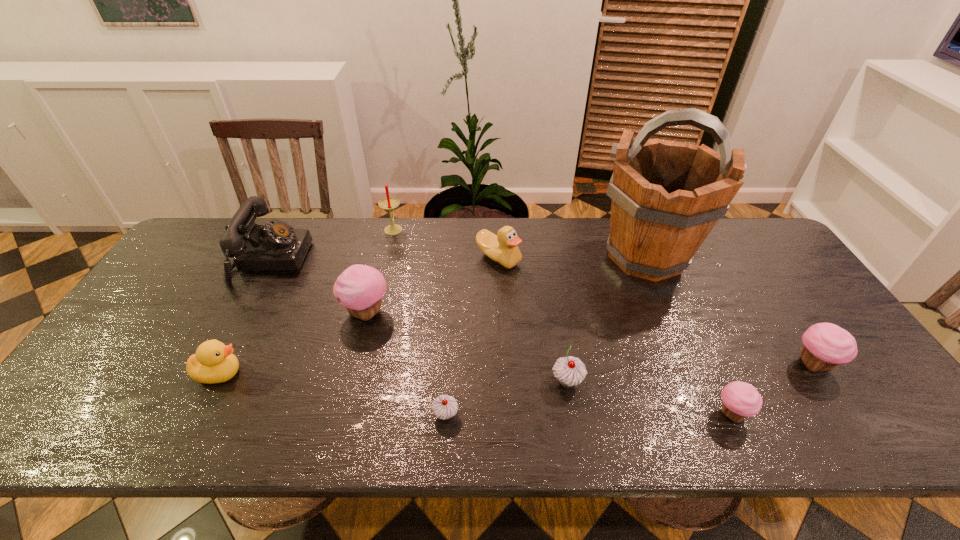
Locate an element on the screen. Image resolution: width=960 pixels, height=540 pixels. bucket is located at coordinates click(667, 196).

Find the location of a particular element. This screenshot has width=960, height=540. candle is located at coordinates (389, 203).

Locate an element on the screen. Image resolution: width=960 pixels, height=540 pixels. black telephone is located at coordinates (276, 246).

This screenshot has width=960, height=540. What are the coordinates of `the tallest cupcake` in the screenshot? It's located at (360, 288).

Identify the location of the sixth nearest object. [360, 288].

Where is `duck`? duck is located at coordinates (503, 248).

Locate an element on the screen. This screenshot has height=540, width=960. beige duck is located at coordinates (503, 248).

Locate an element on the screen. The width and height of the screenshot is (960, 540). the bigger gray cupcake is located at coordinates (570, 371).

This screenshot has height=540, width=960. What are the coordinates of `the farther gray cupcake` in the screenshot? It's located at (570, 371).

The height and width of the screenshot is (540, 960). Identify the location of the rightmost pink cupcake. (825, 345).